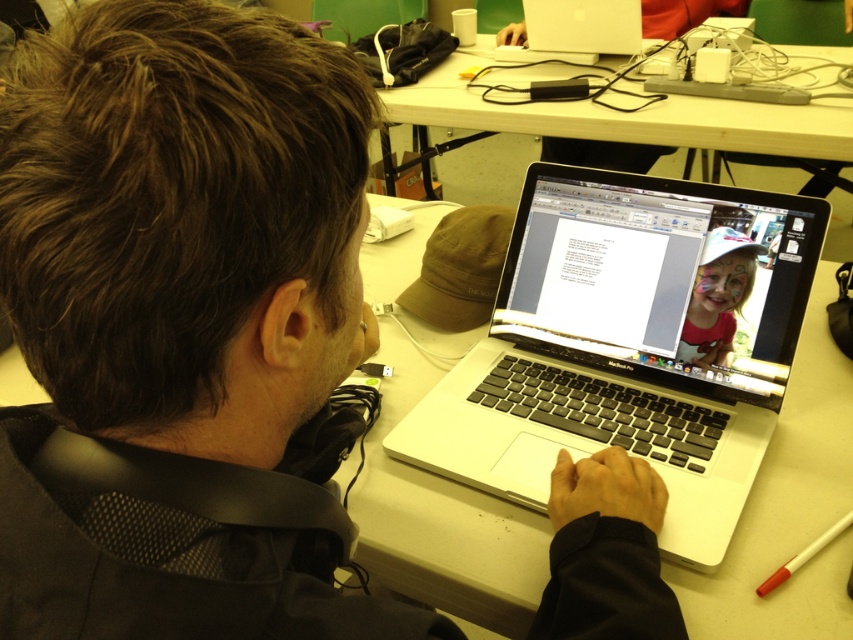
Based on the photo, you are organizing a desk and need to place both the satin silver laptop at center and the white glossy laptop at upper center. Given their sizes, which one should you place first to ensure both fit properly?

The satin silver laptop at center occupies less space than the white glossy laptop at upper center, so you should place the white glossy laptop at upper center first to accommodate its larger size before placing the smaller one.

Where is the matte plastic girl at center located in the image?

The matte plastic girl at center is located at point coordinates of (717, 296).